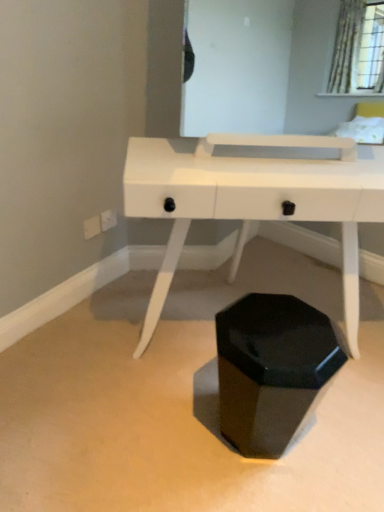
Identify the location of vacant space in front of white glossy desk at center. The image size is (384, 512). (242, 457).